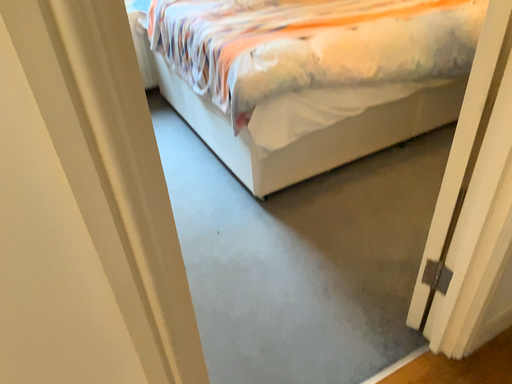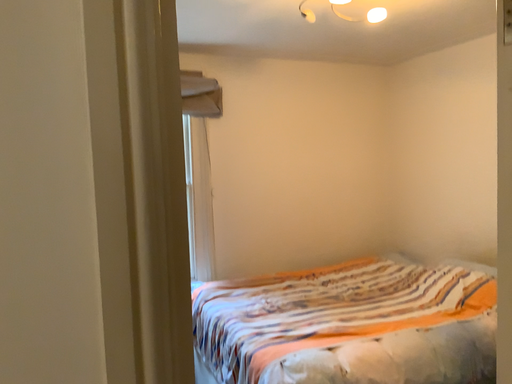
Question: How did the camera likely rotate when shooting the video?

Choices:
 (A) rotated upward
 (B) rotated downward

Answer: (A)